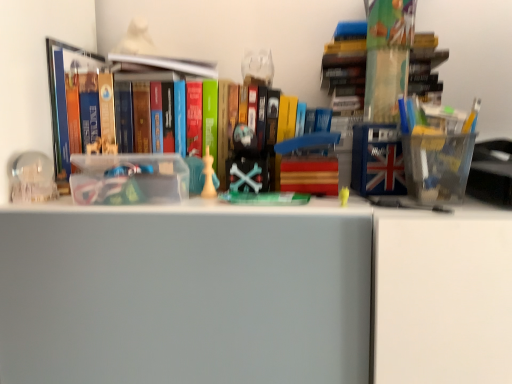
In order to face white matte chess piece at center, which appears as the first toy when viewed from the right, should I rotate leftwards or rightwards?

Rotate left and turn 6.487 degrees.

Where is `hardcover book at upper center, marked as the third book in a right-to-left arrangement`? The image size is (512, 384). hardcover book at upper center, marked as the third book in a right-to-left arrangement is located at coordinates click(162, 65).

Locate an element on the screen. The width and height of the screenshot is (512, 384). translucent plastic container at upper right, which appears as the 1th book when viewed from the right is located at coordinates (346, 70).

Considering the positions of points (199, 65) and (214, 75), is point (199, 65) farther from camera compared to point (214, 75)?

No, it is not.

Considering the relative sizes of hardcover book at center, which is the 2th book from right to left, and hardcover book at upper center, which is the first book from left to right, in the image provided, is hardcover book at center, which is the 2th book from right to left, taller than hardcover book at upper center, which is the first book from left to right,?

Yes.

Is hardcover book at center, which ranks as the 2th book in left-to-right order, at the left side of hardcover book at upper center, marked as the third book in a right-to-left arrangement?

Incorrect, hardcover book at center, which ranks as the 2th book in left-to-right order, is not on the left side of hardcover book at upper center, marked as the third book in a right-to-left arrangement.

Would you say hardcover book at center, which ranks as the 2th book in left-to-right order, is a long distance from hardcover book at upper center, marked as the third book in a right-to-left arrangement?

No.

Is white matte chess piece at center, which appears as the first toy when viewed from the right, bigger or smaller than translucent plastic container at upper right, placed as the third book when sorted from left to right?

Clearly, white matte chess piece at center, which appears as the first toy when viewed from the right, is smaller in size than translucent plastic container at upper right, placed as the third book when sorted from left to right.

Considering the sizes of objects white matte chess piece at center, which appears as the first toy when viewed from the right, and translucent plastic container at upper right, placed as the third book when sorted from left to right, in the image provided, who is wider, white matte chess piece at center, which appears as the first toy when viewed from the right, or translucent plastic container at upper right, placed as the third book when sorted from left to right,?

translucent plastic container at upper right, placed as the third book when sorted from left to right, is wider.

Would you say white matte chess piece at center, which appears as the first toy when viewed from the right, is inside or outside translucent plastic container at upper right, placed as the third book when sorted from left to right?

white matte chess piece at center, which appears as the first toy when viewed from the right, is not inside translucent plastic container at upper right, placed as the third book when sorted from left to right, it's outside.

Consider the image. From a real-world perspective, is white matte chess piece at center, which appears as the first toy when viewed from the right, positioned over translucent plastic container at upper right, placed as the third book when sorted from left to right, based on gravity?

No.

Based on the photo, does translucent plastic container at upper right, placed as the third book when sorted from left to right, come behind white matte chess piece at center, the second toy from the left?

No, it is not.

Which object is positioned more to the right, translucent plastic container at upper right, placed as the third book when sorted from left to right, or white matte chess piece at center, the second toy from the left?

Positioned to the right is translucent plastic container at upper right, placed as the third book when sorted from left to right.

What's the angular difference between translucent plastic container at upper right, which appears as the 1th book when viewed from the right, and white matte chess piece at center, the second toy from the left,'s facing directions?

0.629 degrees.

From the image's perspective, is translucent plastic container at upper right, which appears as the 1th book when viewed from the right, positioned above or below white matte chess piece at center, which appears as the first toy when viewed from the right?

From the image's perspective, translucent plastic container at upper right, which appears as the 1th book when viewed from the right, appears above white matte chess piece at center, which appears as the first toy when viewed from the right.

Is hardcover book at upper center, which is the first book from left to right, turned away from translucent plastic container at upper right, which appears as the 1th book when viewed from the right?

No, hardcover book at upper center, which is the first book from left to right, is not facing away from translucent plastic container at upper right, which appears as the 1th book when viewed from the right.

Between hardcover book at upper center, which is the first book from left to right, and translucent plastic container at upper right, placed as the third book when sorted from left to right, which one has larger size?

translucent plastic container at upper right, placed as the third book when sorted from left to right.

Are hardcover book at upper center, which is the first book from left to right, and translucent plastic container at upper right, which appears as the 1th book when viewed from the right, making contact?

No, hardcover book at upper center, which is the first book from left to right, is not beside translucent plastic container at upper right, which appears as the 1th book when viewed from the right.

Considering their positions, is hardcover book at upper center, which is the first book from left to right, located in front of or behind translucent plastic container at upper right, placed as the third book when sorted from left to right?

Visually, hardcover book at upper center, which is the first book from left to right, is located behind translucent plastic container at upper right, placed as the third book when sorted from left to right.

How different are the orientations of hardcover book at center, which ranks as the 2th book in left-to-right order, and transparent glass sphere at left, the 1th toy when ordered from left to right, in degrees?

The angle between the facing direction of hardcover book at center, which ranks as the 2th book in left-to-right order, and the facing direction of transparent glass sphere at left, the 1th toy when ordered from left to right, is 1.2 degrees.

In terms of width, does hardcover book at center, which ranks as the 2th book in left-to-right order, look wider or thinner when compared to transparent glass sphere at left, the 1th toy when ordered from left to right?

hardcover book at center, which ranks as the 2th book in left-to-right order, is wider than transparent glass sphere at left, the 1th toy when ordered from left to right.

Is hardcover book at center, which is the 2th book from right to left, turned away from transparent glass sphere at left, which appears as the 2th toy when viewed from the right?

hardcover book at center, which is the 2th book from right to left, does not have its back to transparent glass sphere at left, which appears as the 2th toy when viewed from the right.

Is transparent glass sphere at left, which appears as the 2th toy when viewed from the right, completely or partially outside of hardcover book at upper center, marked as the third book in a right-to-left arrangement?

transparent glass sphere at left, which appears as the 2th toy when viewed from the right, lies outside hardcover book at upper center, marked as the third book in a right-to-left arrangement,'s area.

Looking at their sizes, would you say transparent glass sphere at left, which appears as the 2th toy when viewed from the right, is wider or thinner than hardcover book at upper center, marked as the third book in a right-to-left arrangement?

In the image, transparent glass sphere at left, which appears as the 2th toy when viewed from the right, appears to be more narrow than hardcover book at upper center, marked as the third book in a right-to-left arrangement.

Find the location of `book that is the 3rd object above the transparent glass sphere at left, which appears as the 2th toy when viewed from the right (from a real-world perspective)`. book that is the 3rd object above the transparent glass sphere at left, which appears as the 2th toy when viewed from the right (from a real-world perspective) is located at coordinates (162, 65).

From a real-world perspective, relative to hardcover book at upper center, marked as the third book in a right-to-left arrangement, is transparent glass sphere at left, which appears as the 2th toy when viewed from the right, vertically above or below?

From a real-world perspective, transparent glass sphere at left, which appears as the 2th toy when viewed from the right, is physically below hardcover book at upper center, marked as the third book in a right-to-left arrangement.

Locate an element on the screen. The image size is (512, 384). toy that appears in front of the white matte chess piece at center, which appears as the first toy when viewed from the right is located at coordinates (32, 178).

Does transparent glass sphere at left, the 1th toy when ordered from left to right, contain white matte chess piece at center, which appears as the first toy when viewed from the right?

That's incorrect, white matte chess piece at center, which appears as the first toy when viewed from the right, is not inside transparent glass sphere at left, the 1th toy when ordered from left to right.

Does transparent glass sphere at left, the 1th toy when ordered from left to right, have a greater width compared to white matte chess piece at center, the second toy from the left?

Indeed, transparent glass sphere at left, the 1th toy when ordered from left to right, has a greater width compared to white matte chess piece at center, the second toy from the left.

At what (x,y) coordinates should I click in order to perform the action: click on book that is the 2nd one above the hardcover book at center, which ranks as the 2th book in left-to-right order (from a real-world perspective). Please return your answer as a coordinate pair (x, y). The width and height of the screenshot is (512, 384). Looking at the image, I should click on (162, 65).

Where is `the 2nd toy behind when counting from the translucent plastic container at upper right, placed as the third book when sorted from left to right`? Image resolution: width=512 pixels, height=384 pixels. the 2nd toy behind when counting from the translucent plastic container at upper right, placed as the third book when sorted from left to right is located at coordinates (208, 176).

Considering their positions, is hardcover book at center, which ranks as the 2th book in left-to-right order, positioned closer to white matte chess piece at center, the second toy from the left, than hardcover book at upper center, marked as the third book in a right-to-left arrangement?

Among the two, hardcover book at upper center, marked as the third book in a right-to-left arrangement, is located nearer to white matte chess piece at center, the second toy from the left.

Which object lies nearer to the anchor point translucent plastic container at upper right, which appears as the 1th book when viewed from the right, white matte chess piece at center, the second toy from the left, or hardcover book at upper center, marked as the third book in a right-to-left arrangement?

hardcover book at upper center, marked as the third book in a right-to-left arrangement, lies closer to translucent plastic container at upper right, which appears as the 1th book when viewed from the right, than the other object.

Based on their spatial positions, is white matte chess piece at center, which appears as the first toy when viewed from the right, or transparent glass sphere at left, the 1th toy when ordered from left to right, closer to translucent plastic container at upper right, placed as the third book when sorted from left to right?

white matte chess piece at center, which appears as the first toy when viewed from the right.

Which object lies nearer to the anchor point hardcover book at upper center, which is the first book from left to right, hardcover book at center, which ranks as the 2th book in left-to-right order, or transparent glass sphere at left, the 1th toy when ordered from left to right?

The object closer to hardcover book at upper center, which is the first book from left to right, is hardcover book at center, which ranks as the 2th book in left-to-right order.

When comparing their distances from hardcover book at upper center, marked as the third book in a right-to-left arrangement, does hardcover book at center, which is the 2th book from right to left, or white matte chess piece at center, the second toy from the left, seem further?

The object further to hardcover book at upper center, marked as the third book in a right-to-left arrangement, is white matte chess piece at center, the second toy from the left.

Which object lies further to the anchor point hardcover book at center, which is the 2th book from right to left, transparent glass sphere at left, which appears as the 2th toy when viewed from the right, or translucent plastic container at upper right, which appears as the 1th book when viewed from the right?

Based on the image, translucent plastic container at upper right, which appears as the 1th book when viewed from the right, appears to be further to hardcover book at center, which is the 2th book from right to left.

Based on their spatial positions, is white matte chess piece at center, which appears as the first toy when viewed from the right, or translucent plastic container at upper right, placed as the third book when sorted from left to right, closer to transparent glass sphere at left, the 1th toy when ordered from left to right?

Based on the image, white matte chess piece at center, which appears as the first toy when viewed from the right, appears to be nearer to transparent glass sphere at left, the 1th toy when ordered from left to right.

Considering their positions, is hardcover book at upper center, marked as the third book in a right-to-left arrangement, positioned further to translucent plastic container at upper right, which appears as the 1th book when viewed from the right, than white matte chess piece at center, the second toy from the left?

Based on the image, white matte chess piece at center, the second toy from the left, appears to be further to translucent plastic container at upper right, which appears as the 1th book when viewed from the right.

You are a GUI agent. You are given a task and a screenshot of the screen. Output one action in this format:
    pyautogui.click(x=<x>, y=<y>)
    Task: Click on the toy between hardcover book at upper center, which is the first book from left to right, and translucent plastic container at upper right, placed as the third book when sorted from left to right, from left to right
    
    Given the screenshot: What is the action you would take?
    pyautogui.click(x=208, y=176)

What are the coordinates of `book between hardcover book at upper center, which is the first book from left to right, and translucent plastic container at upper right, placed as the third book when sorted from left to right, in the horizontal direction` in the screenshot? It's located at (79, 90).

This screenshot has height=384, width=512. Identify the location of toy located between hardcover book at center, which ranks as the 2th book in left-to-right order, and translucent plastic container at upper right, which appears as the 1th book when viewed from the right, in the left-right direction. (208, 176).

You are a GUI agent. You are given a task and a screenshot of the screen. Output one action in this format:
    pyautogui.click(x=<x>, y=<y>)
    Task: Click on the toy between transparent glass sphere at left, which appears as the 2th toy when viewed from the right, and translucent plastic container at upper right, which appears as the 1th book when viewed from the right
    The height and width of the screenshot is (384, 512).
    Given the screenshot: What is the action you would take?
    pyautogui.click(x=208, y=176)